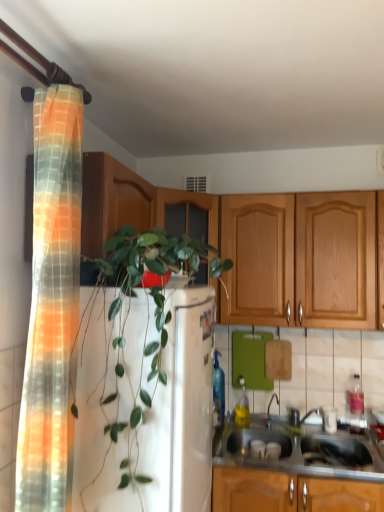
This screenshot has height=512, width=384. I want to click on free space above stainless steel sink at lower right (from a real-world perspective), so click(310, 448).